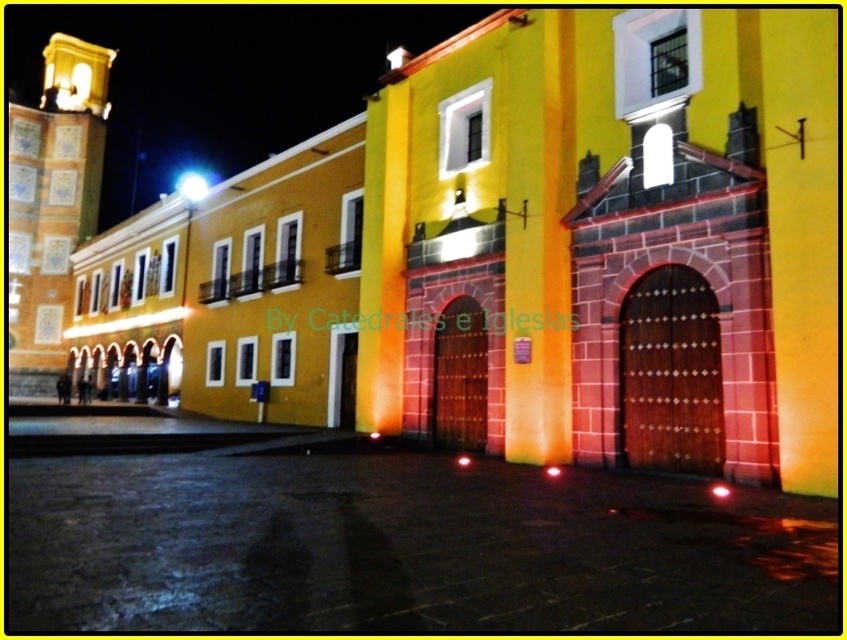
Is matte yellow church at center above golden mosaic tile bell tower at left?

No.

In order to click on matte yellow church at center in this screenshot , I will do `click(610, 243)`.